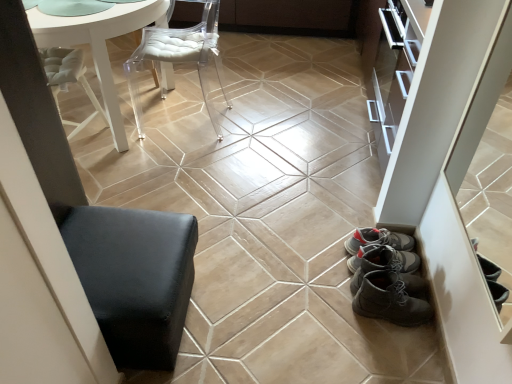
Where is `free spot in front of transparent acrylic chair at upper center`? Image resolution: width=512 pixels, height=384 pixels. free spot in front of transparent acrylic chair at upper center is located at coordinates (186, 163).